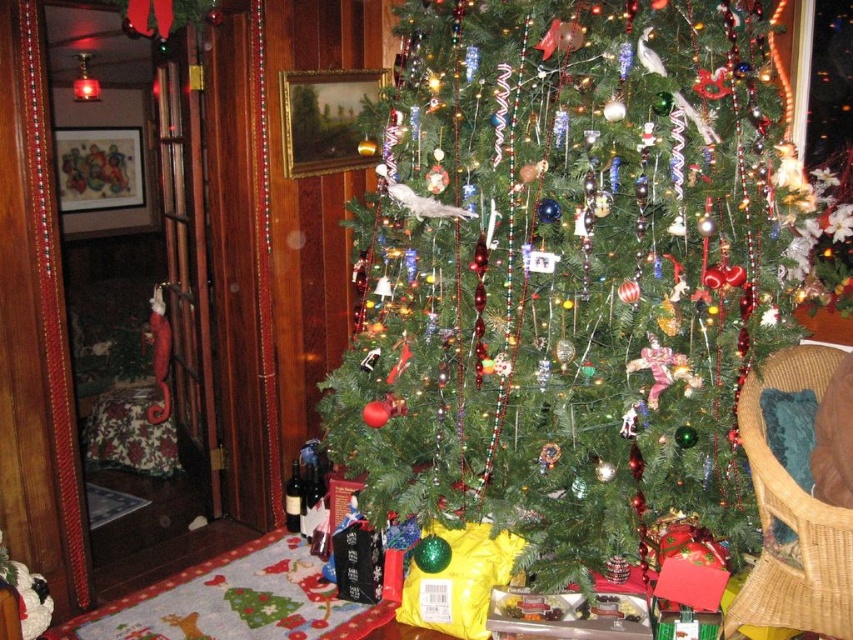
Is woven wicker chair at lower right further to camera compared to matte glass wine bottle at lower left?

No, it is not.

Between woven wicker chair at lower right and matte glass wine bottle at lower left, which one has more height?

woven wicker chair at lower right is taller.

Where is `woven wicker chair at lower right`? woven wicker chair at lower right is located at coordinates (799, 492).

From the picture: Can you confirm if green matte christmas tree at center is positioned above woven wicker chair at lower right?

Correct, green matte christmas tree at center is located above woven wicker chair at lower right.

Can you confirm if green matte christmas tree at center is positioned below woven wicker chair at lower right?

Actually, green matte christmas tree at center is above woven wicker chair at lower right.

Is point (511, 376) in front of point (764, 484)?

No.

This screenshot has width=853, height=640. I want to click on green matte christmas tree at center, so click(x=569, y=275).

Between woven wicker chair at lower right and matte glass wine bottle at lower center, which one appears on the left side from the viewer's perspective?

Positioned to the left is matte glass wine bottle at lower center.

Consider the image. Who is more forward, (808, 344) or (318, 502)?

Point (808, 344) is in front.

Does point (767, 477) come in front of point (320, 490)?

Yes.

You are a GUI agent. You are given a task and a screenshot of the screen. Output one action in this format:
    pyautogui.click(x=<x>, y=<y>)
    Task: Click on the woven wicker chair at lower right
    This screenshot has width=853, height=640.
    Given the screenshot: What is the action you would take?
    pyautogui.click(x=799, y=492)